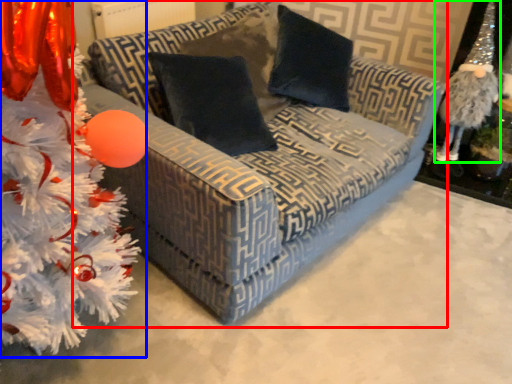
Question: Which object is the closest to the studio couch (highlighted by a red box)? Choose among these: christmas tree (highlighted by a blue box) or toy (highlighted by a green box).

Choices:
 (A) christmas tree
 (B) toy

Answer: (A)